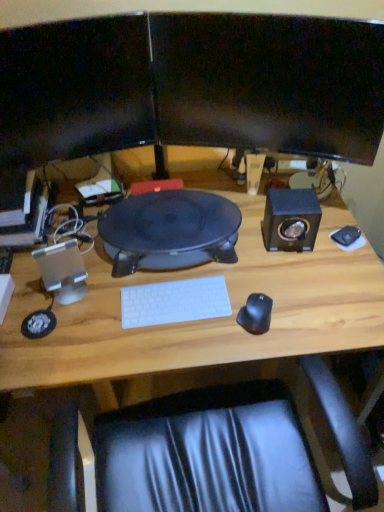
Image resolution: width=384 pixels, height=512 pixels. Identify the location of vacant area that lies between white plastic keyboard at center and matte black speaker at center. (168, 282).